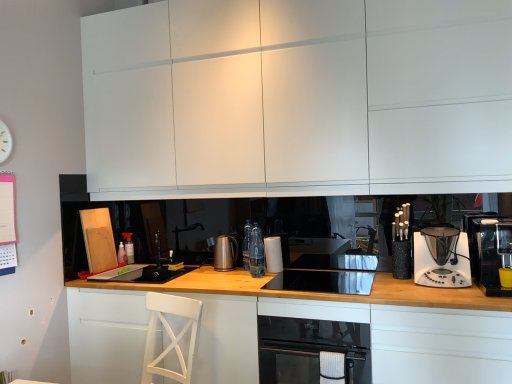
Identify the location of free space to the left of satin silver kettle at center, which is the third kitchen appliance in right-to-left order. (199, 268).